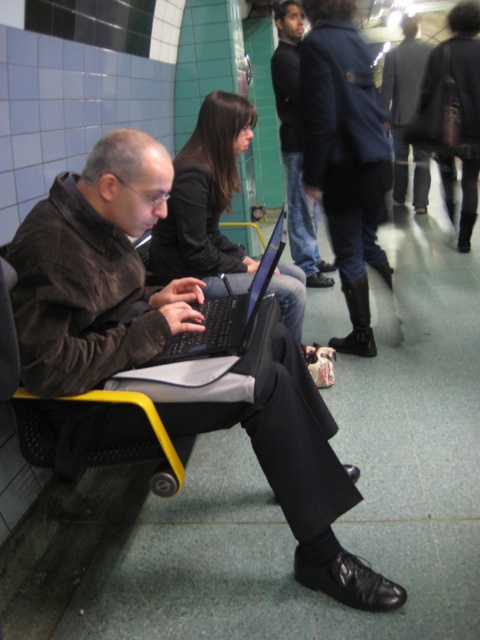
Question: Can you confirm if matte black laptop at center is positioned to the right of black matte laptop at center?

Choices:
 (A) no
 (B) yes

Answer: (A)

Question: Is dark blue leather jacket at center further to camera compared to black matte laptop at center?

Choices:
 (A) no
 (B) yes

Answer: (B)

Question: Estimate the real-world distances between objects in this image. Which object is closer to the dark blue leather jacket at center?

Choices:
 (A) black matte laptop at center
 (B) matte black laptop at center

Answer: (A)

Question: Estimate the real-world distances between objects in this image. Which object is closer to the black matte laptop at center?

Choices:
 (A) dark blue jeans at center
 (B) matte black laptop at center
 (C) dark blue leather jacket at center

Answer: (B)

Question: Among these points, which one is nearest to the camera?

Choices:
 (A) (352, 6)
 (B) (301, 218)
 (C) (244, 326)

Answer: (C)

Question: Is matte black laptop at center to the left of dark blue leather jacket at center from the viewer's perspective?

Choices:
 (A) yes
 (B) no

Answer: (A)